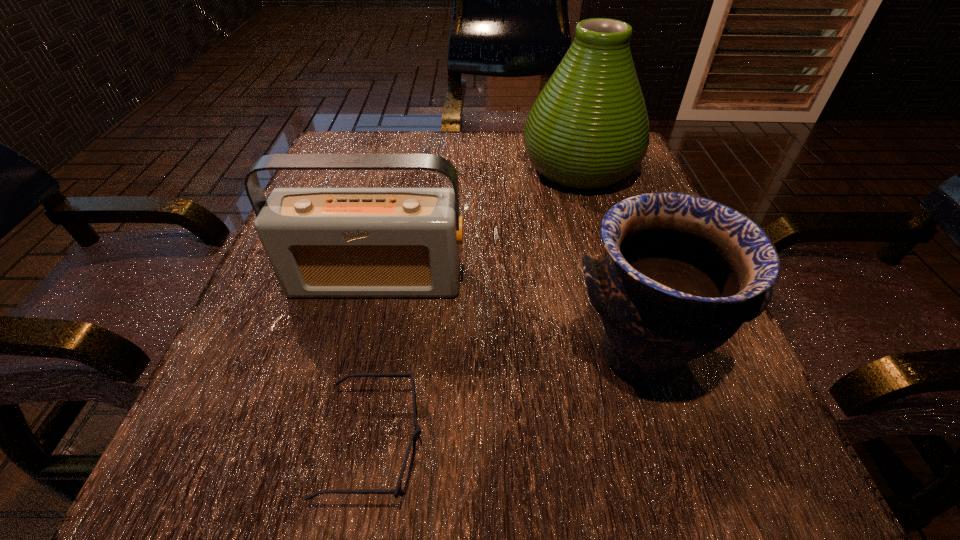
The height and width of the screenshot is (540, 960). Find the location of `vase`. vase is located at coordinates (588, 129).

At what (x,y) coordinates should I click in order to perform the action: click on the tallest object. Please return your answer as a coordinate pair (x, y). Image resolution: width=960 pixels, height=540 pixels. Looking at the image, I should click on 588,129.

Find the location of a particular element. The width and height of the screenshot is (960, 540). radio receiver is located at coordinates (321, 242).

This screenshot has width=960, height=540. Identify the location of pottery. (681, 273).

This screenshot has width=960, height=540. I want to click on the shortest object, so click(398, 491).

I want to click on free spot located 0.190m on the left of the farthest object, so point(438,167).

Where is `vacant space situated on the front-facing side of the third nearest object`? vacant space situated on the front-facing side of the third nearest object is located at coordinates (347, 408).

At what (x,y) coordinates should I click in order to perform the action: click on free space located 0.090m on the front-facing side of the spectacles. Please return your answer as a coordinate pair (x, y). This screenshot has height=540, width=960. Looking at the image, I should click on (496, 444).

This screenshot has width=960, height=540. Find the location of `object that is at the far edge`. object that is at the far edge is located at coordinates (588, 129).

At what (x,y) coordinates should I click in order to perform the action: click on object located in the near edge section of the desktop. Please return your answer as a coordinate pair (x, y). Looking at the image, I should click on (398, 491).